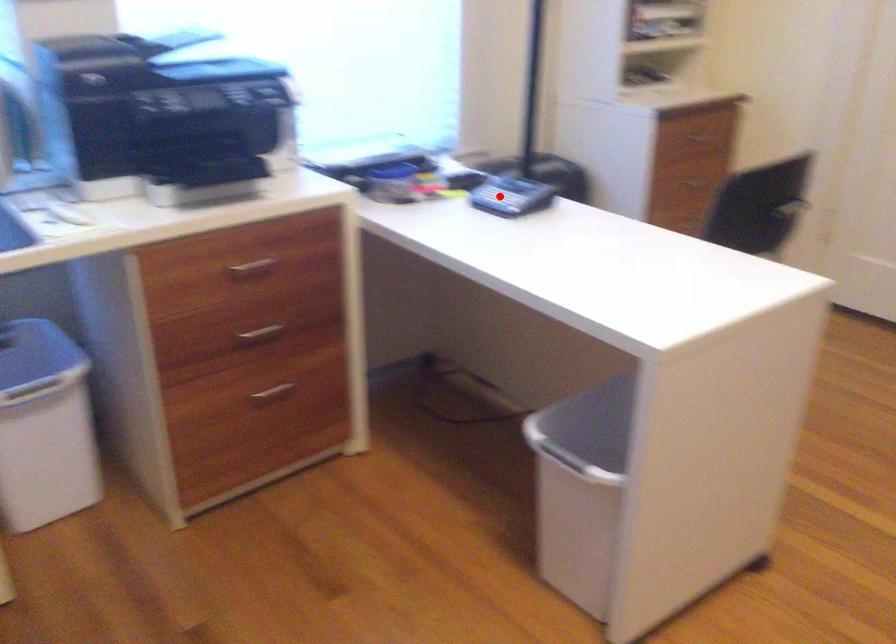
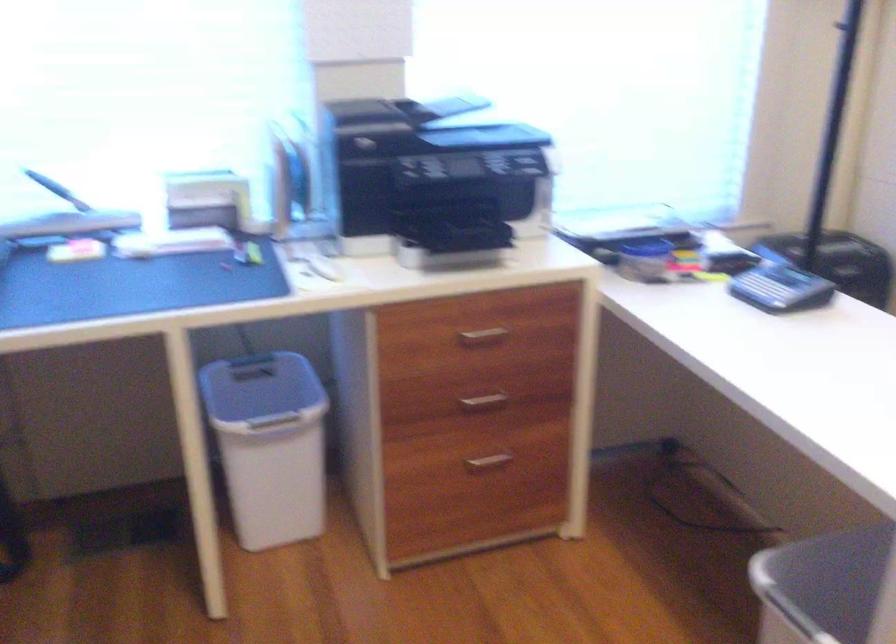
Find the pixel in the second image that matches the highlighted location in the first image.

(763, 289)